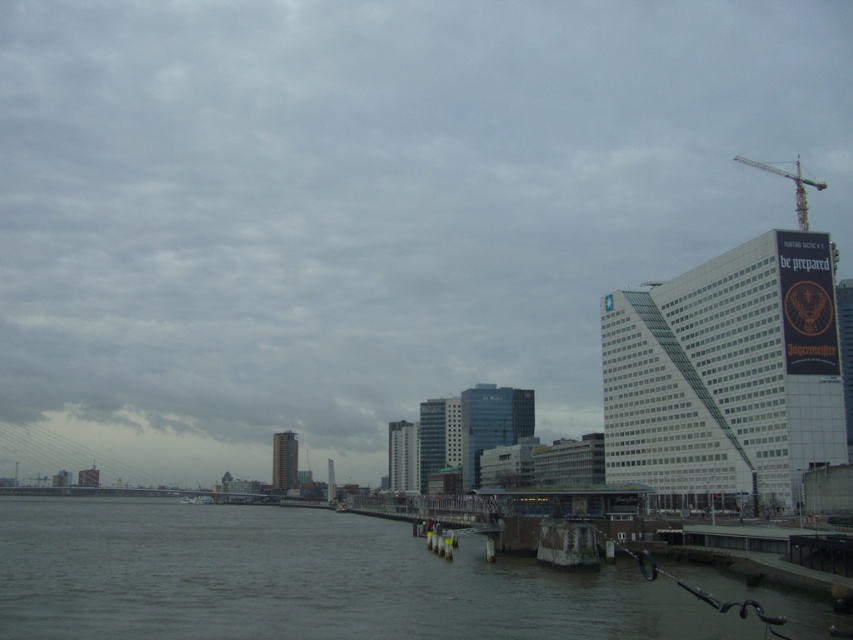
Question: Which point is farther to the camera?

Choices:
 (A) gray concrete water at lower left
 (B) metallic yellow crane at upper right

Answer: (B)

Question: In this image, where is gray concrete water at lower left located relative to metallic yellow crane at upper right?

Choices:
 (A) right
 (B) left

Answer: (B)

Question: Does gray concrete water at lower left appear under metallic yellow crane at upper right?

Choices:
 (A) no
 (B) yes

Answer: (B)

Question: Does gray concrete water at lower left have a lesser width compared to metallic yellow crane at upper right?

Choices:
 (A) no
 (B) yes

Answer: (A)

Question: Which object appears closest to the camera in this image?

Choices:
 (A) gray concrete water at lower left
 (B) metallic yellow crane at upper right

Answer: (A)